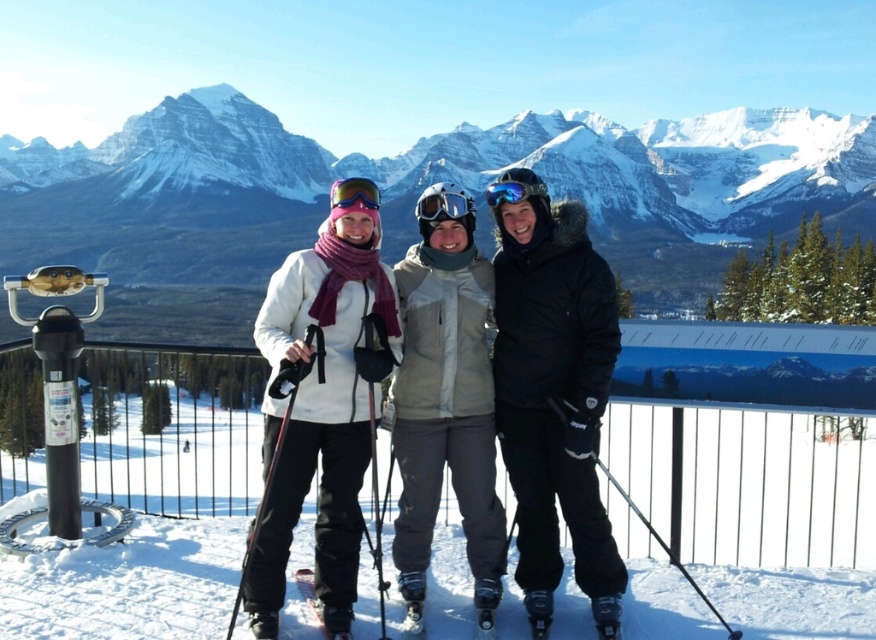
In the scene, there are two pairs of goggles at the center of the image. The first pair is transparent plastic goggles at center, and the second pair is matte blue goggles at center. Which of these two pairs is located to the right of the other?

The transparent plastic goggles at center is positioned on the right side of matte blue goggles at center, so the transparent plastic goggles at center is to the right of the matte blue goggles at center.

You are a photographer trying to capture a clear shot of the transparent plastic goggles at center and the matte blue goggles at center. Which pair of goggles will allow you to see through them better?

The transparent plastic goggles at center are positioned under matte blue goggles at center, so the transparent plastic goggles at center allow better visibility through them.

You are a photographer positioned at the camera location. You want to take a photo of the white fleece jacket at center. Is the jacket within your camera lens range if your camera has a maximum zoom of 60 meters?

The white fleece jacket at center is 61.83 meters away from the camera. Since the camera can only zoom up to 60 meters, the jacket is slightly out of range and cannot be captured clearly without moving closer or using a different camera with greater zoom capability.